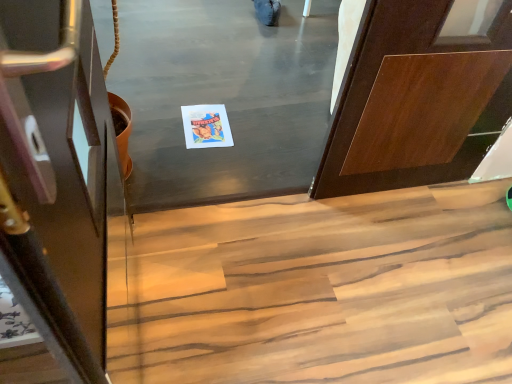
Question: Are shiny dark wood door at left and wooden stairs at lower center located far from each other?

Choices:
 (A) yes
 (B) no

Answer: (B)

Question: Does shiny dark wood door at left have a lesser width compared to wooden stairs at lower center?

Choices:
 (A) no
 (B) yes

Answer: (B)

Question: Can you confirm if shiny dark wood door at left is wider than wooden stairs at lower center?

Choices:
 (A) no
 (B) yes

Answer: (A)

Question: From the image's perspective, is shiny dark wood door at left over wooden stairs at lower center?

Choices:
 (A) no
 (B) yes

Answer: (B)

Question: Is shiny dark wood door at left closer to camera compared to wooden stairs at lower center?

Choices:
 (A) yes
 (B) no

Answer: (A)

Question: Is shiny dark wood door at left completely or partially outside of wooden stairs at lower center?

Choices:
 (A) yes
 (B) no

Answer: (A)

Question: Considering the relative sizes of matte paper postcard at center and shiny dark wood door at left in the image provided, is matte paper postcard at center wider than shiny dark wood door at left?

Choices:
 (A) no
 (B) yes

Answer: (A)

Question: Can you confirm if matte paper postcard at center is taller than shiny dark wood door at left?

Choices:
 (A) yes
 (B) no

Answer: (B)

Question: From the image's perspective, does matte paper postcard at center appear lower than shiny dark wood door at left?

Choices:
 (A) no
 (B) yes

Answer: (A)

Question: From a real-world perspective, does matte paper postcard at center stand above shiny dark wood door at left?

Choices:
 (A) yes
 (B) no

Answer: (B)

Question: Is matte paper postcard at center bigger than shiny dark wood door at left?

Choices:
 (A) no
 (B) yes

Answer: (A)

Question: Is matte paper postcard at center positioned with its back to shiny dark wood door at left?

Choices:
 (A) no
 (B) yes

Answer: (A)

Question: Does wooden stairs at lower center appear on the left side of shiny dark wood door at left?

Choices:
 (A) no
 (B) yes

Answer: (A)